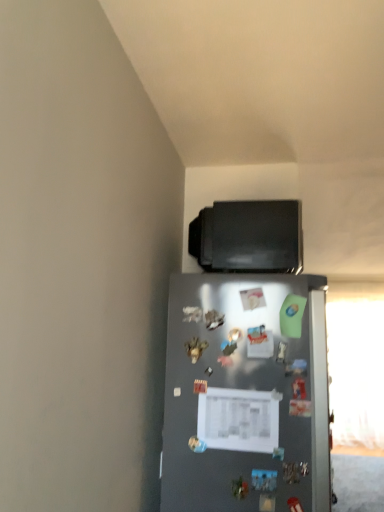
Identify the location of satin silver refrigerator at center. Image resolution: width=384 pixels, height=512 pixels. (246, 394).

This screenshot has height=512, width=384. Describe the element at coordinates (246, 394) in the screenshot. I see `satin silver refrigerator at center` at that location.

You are a GUI agent. You are given a task and a screenshot of the screen. Output one action in this format:
    pyautogui.click(x=<x>, y=<y>)
    Task: Click on the black matte tv at upper center
    Image resolution: width=384 pixels, height=512 pixels.
    Given the screenshot: What is the action you would take?
    pyautogui.click(x=248, y=237)

The image size is (384, 512). What do you see at coordinates (248, 237) in the screenshot? I see `black matte tv at upper center` at bounding box center [248, 237].

Locate an element on the screen. This screenshot has height=512, width=384. satin silver refrigerator at center is located at coordinates (246, 394).

Which object is positioned more to the right, black matte tv at upper center or satin silver refrigerator at center?

black matte tv at upper center.

Is black matte tv at upper center behind satin silver refrigerator at center?

Yes, black matte tv at upper center is further from the viewer.

Is point (297, 203) closer or farther from the camera than point (275, 288)?

Point (297, 203) is positioned farther from the camera compared to point (275, 288).

From the image's perspective, which one is positioned lower, black matte tv at upper center or satin silver refrigerator at center?

From the image's view, satin silver refrigerator at center is below.

From a real-world perspective, is black matte tv at upper center physically below satin silver refrigerator at center?

Actually, black matte tv at upper center is physically above satin silver refrigerator at center in the real world.

Can you confirm if black matte tv at upper center is thinner than satin silver refrigerator at center?

Correct, the width of black matte tv at upper center is less than that of satin silver refrigerator at center.

Which of these two, black matte tv at upper center or satin silver refrigerator at center, stands taller?

satin silver refrigerator at center is taller.

Considering the sizes of objects black matte tv at upper center and satin silver refrigerator at center in the image provided, who is smaller, black matte tv at upper center or satin silver refrigerator at center?

black matte tv at upper center.

Would you say black matte tv at upper center is outside satin silver refrigerator at center?

Yes, black matte tv at upper center is located beyond the bounds of satin silver refrigerator at center.

Is black matte tv at upper center directly adjacent to satin silver refrigerator at center?

black matte tv at upper center and satin silver refrigerator at center are clearly separated.

Could you tell me if black matte tv at upper center is turned towards satin silver refrigerator at center?

No, black matte tv at upper center is not aimed at satin silver refrigerator at center.

Where is `refrigerator located underneath the black matte tv at upper center (from a real-world perspective)`? The width and height of the screenshot is (384, 512). refrigerator located underneath the black matte tv at upper center (from a real-world perspective) is located at coordinates (246, 394).

Considering the relative positions of satin silver refrigerator at center and black matte tv at upper center in the image provided, is satin silver refrigerator at center to the left of black matte tv at upper center from the viewer's perspective?

Indeed, satin silver refrigerator at center is positioned on the left side of black matte tv at upper center.

In the image, is satin silver refrigerator at center positioned in front of or behind black matte tv at upper center?

In the image, satin silver refrigerator at center appears in front of black matte tv at upper center.

Is point (275, 425) less distant than point (284, 216)?

Yes, it is in front of point (284, 216).

From the image's perspective, is satin silver refrigerator at center located above or below black matte tv at upper center?

satin silver refrigerator at center is situated lower than black matte tv at upper center in the image.

From a real-world perspective, is satin silver refrigerator at center beneath black matte tv at upper center?

Correct, in the physical world, satin silver refrigerator at center is lower than black matte tv at upper center.

Which object is thinner, satin silver refrigerator at center or black matte tv at upper center?

With smaller width is black matte tv at upper center.

Is satin silver refrigerator at center taller or shorter than black matte tv at upper center?

Clearly, satin silver refrigerator at center is taller compared to black matte tv at upper center.

Looking at this image, considering the sizes of objects satin silver refrigerator at center and black matte tv at upper center in the image provided, who is smaller, satin silver refrigerator at center or black matte tv at upper center?

Smaller between the two is black matte tv at upper center.

From the picture: Is satin silver refrigerator at center inside or outside of black matte tv at upper center?

satin silver refrigerator at center is outside black matte tv at upper center.

From the picture: Is satin silver refrigerator at center placed right next to black matte tv at upper center?

satin silver refrigerator at center is not next to black matte tv at upper center, and they're not touching.

Is satin silver refrigerator at center aimed at black matte tv at upper center?

No.

Find the location of a particular element. The width and height of the screenshot is (384, 512). refrigerator below the black matte tv at upper center (from a real-world perspective) is located at coordinates (246, 394).

Identify the location of refrigerator on the left of black matte tv at upper center. (246, 394).

The image size is (384, 512). There is a satin silver refrigerator at center. Find the location of `appliance above it (from a real-world perspective)`. appliance above it (from a real-world perspective) is located at coordinates (248, 237).